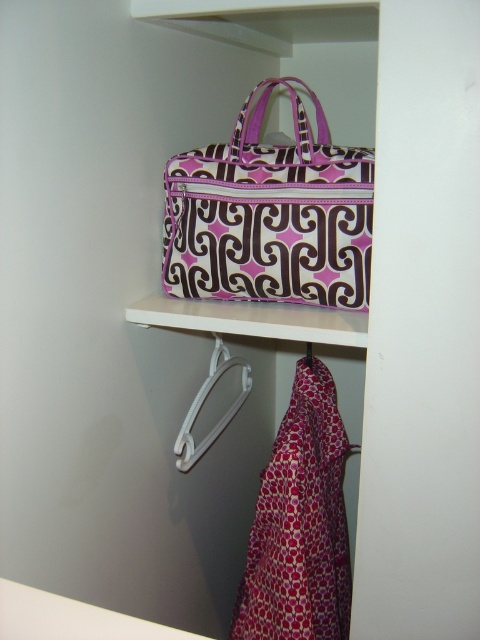
Based on the photo, which is more to the right, purple fabric bag at upper center or white plastic hanger at lower center?

From the viewer's perspective, purple fabric bag at upper center appears more on the right side.

Does purple fabric bag at upper center have a greater width compared to white plastic hanger at lower center?

Yes.

Is point (175, 260) positioned in front of point (224, 420)?

Yes, it is in front of point (224, 420).

Find the location of a particular element. This screenshot has height=640, width=480. purple fabric bag at upper center is located at coordinates (269, 214).